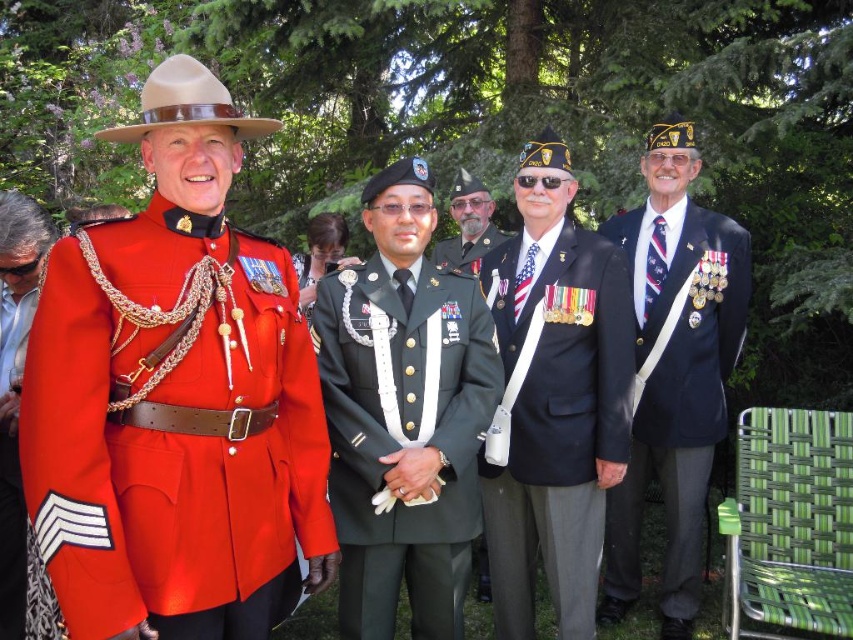
Question: Among these objects, which one is farthest from the camera?

Choices:
 (A) navy blue wool suit at center
 (B) shiny red fabric at left
 (C) green military uniform at center

Answer: (A)

Question: Observing the image, what is the correct spatial positioning of green military uniform at center in reference to shiny red fabric at left?

Choices:
 (A) above
 (B) below

Answer: (A)

Question: Among these objects, which one is nearest to the camera?

Choices:
 (A) shiny red fabric at left
 (B) navy blue wool suit at center

Answer: (A)

Question: Is shiny red fabric at left further to camera compared to green fabric uniform at center?

Choices:
 (A) yes
 (B) no

Answer: (B)

Question: Is navy blue fabric suit at right thinner than shiny red fabric at left?

Choices:
 (A) yes
 (B) no

Answer: (B)

Question: Which of the following is the farthest from the observer?

Choices:
 (A) navy blue fabric suit at right
 (B) green uniform at center
 (C) navy blue wool suit at center

Answer: (B)